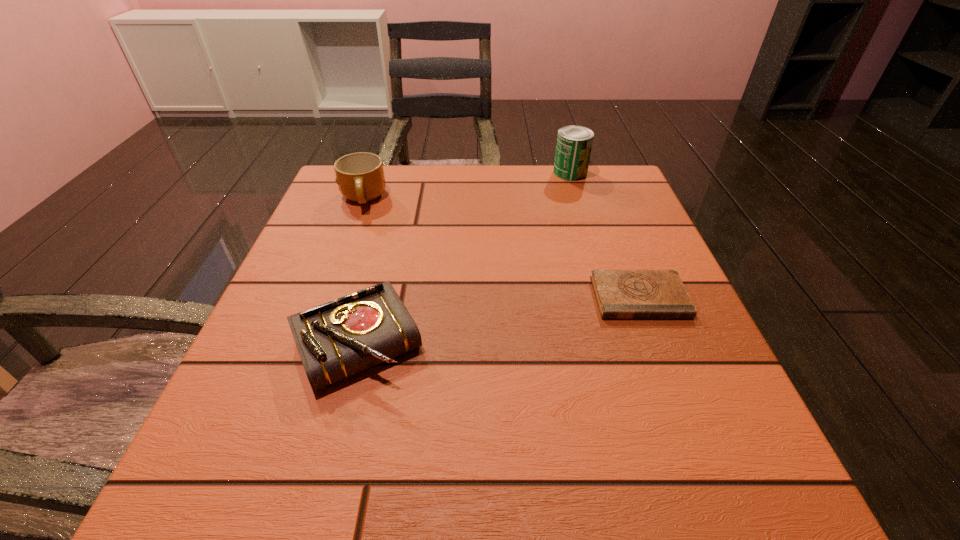
At what (x,y) coordinates should I click in order to perform the action: click on vacant position located 0.370m on the right of the third tallest object. Please return your answer as a coordinate pair (x, y). The width and height of the screenshot is (960, 540). Looking at the image, I should click on (655, 344).

Locate an element on the screen. Image resolution: width=960 pixels, height=540 pixels. free location located 0.230m on the spine side of the shorter diary is located at coordinates (698, 450).

Where is `can that is at the far edge`? This screenshot has width=960, height=540. can that is at the far edge is located at coordinates (574, 143).

Locate an element on the screen. Image resolution: width=960 pixels, height=540 pixels. mug present at the far edge is located at coordinates (360, 177).

The height and width of the screenshot is (540, 960). In order to click on mug situated at the left edge in this screenshot , I will do (x=360, y=177).

Locate an element on the screen. diary situated at the left edge is located at coordinates (335, 340).

Locate an element on the screen. The image size is (960, 540). can located in the right edge section of the desktop is located at coordinates (574, 143).

Where is `diary that is positioned at the right edge`? The height and width of the screenshot is (540, 960). diary that is positioned at the right edge is located at coordinates (620, 294).

This screenshot has height=540, width=960. What are the coordinates of `object at the far left corner` in the screenshot? It's located at (360, 177).

At what (x,y) coordinates should I click in order to perform the action: click on object at the far right corner. Please return your answer as a coordinate pair (x, y). The image size is (960, 540). Looking at the image, I should click on (574, 143).